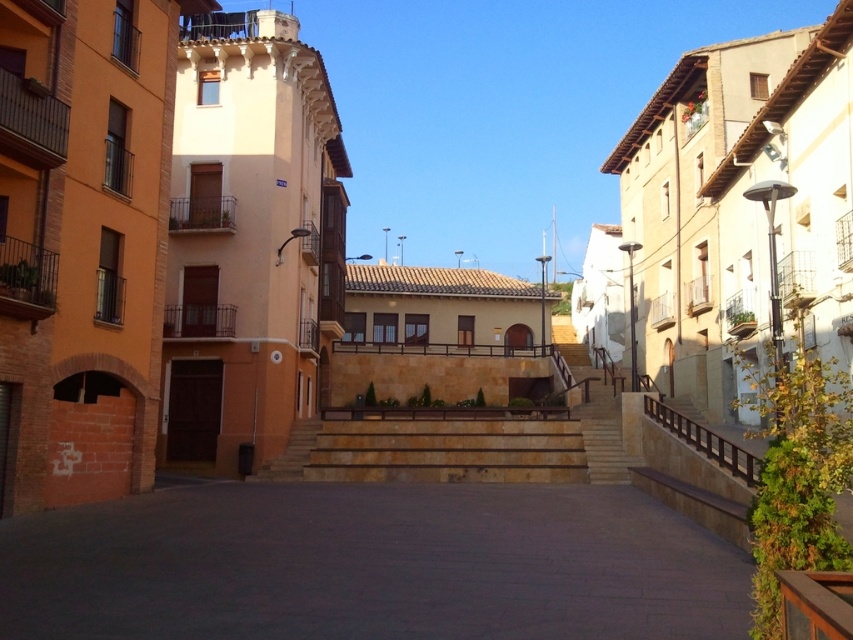
You are standing on the raised platform with small green shrubs and want to walk down to the paved square below. There are two sets of stairs, natural stone stairs at center and beige stone stairs at center. Which set of stairs should you use to descend directly to the square without needing to walk around any obstacles?

You should use the natural stone stairs at center because the beige stone stairs at center are positioned behind them, making the natural stone stairs the ones directly accessible to the square.

You are standing in the urban square and want to find the dark gray concrete alley at center. According to the coordinates provided, where should you look?

The dark gray concrete alley at center is located at point coordinates of (370, 564).